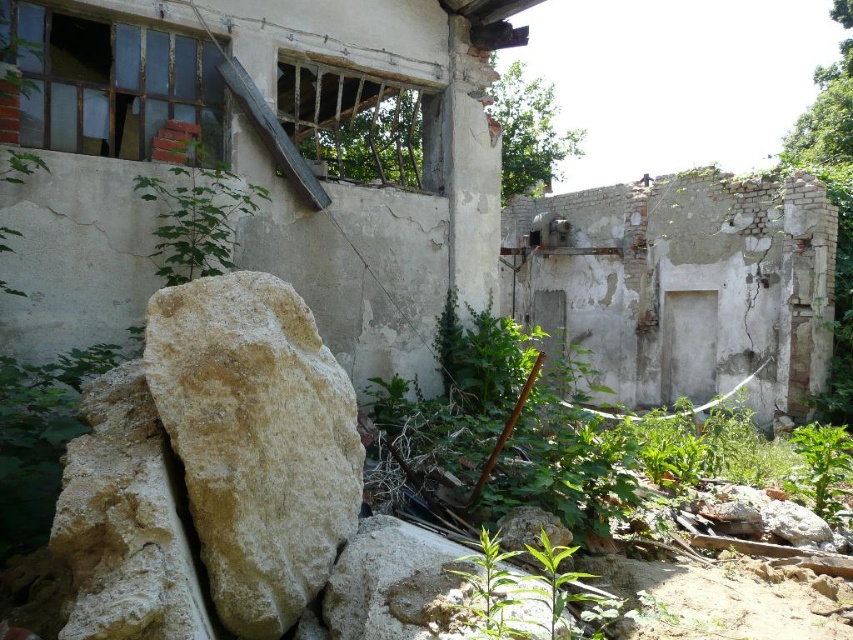
You are a construction worker assessing the site. You see the light beige stone at center and the green leafy plant at upper left. Which object is wider in terms of their base width?

The green leafy plant at upper left is wider in terms of their base width because the light beige stone at center is thinner than it.

You are a construction worker tasked with clearing debris in the abandoned building. You need to move the light beige stone at center and the green leafy plant at lower right to a disposal area. Which object should you move first if you want to handle the larger items first?

The light beige stone at center should be moved first since it has a larger size compared to the green leafy plant at lower right.

You are a construction worker who needs to place a new sensor on the highest point in the area. Which object between the light beige stone at center and the green leafy plant at lower right should you choose?

The light beige stone at center is above the green leafy plant at lower right, so you should place the sensor on the light beige stone at center as it is the highest point.